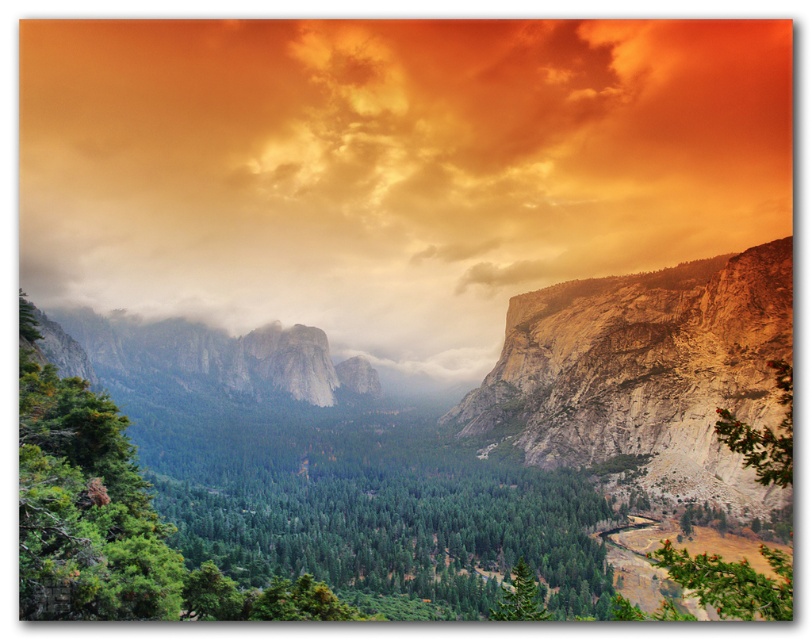
You are planning to take a photo of the rugged granite mountains at center and the green matte tree at lower center. Which object should you focus on first if you want to capture both in a single frame without moving the camera?

You should focus on the rugged granite mountains at center first because they are larger in size compared to the green matte tree at lower center, making them the main subject for the frame.